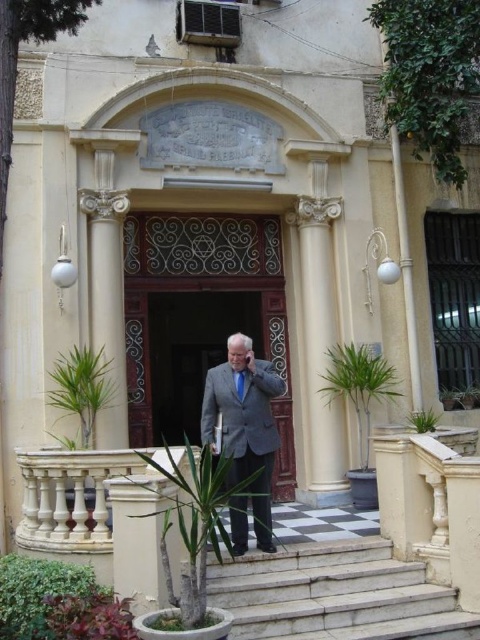
Question: Which point appears farthest from the camera in this image?

Choices:
 (A) (277, 234)
 (B) (347, 548)

Answer: (A)

Question: Can you confirm if white marble stairs at center is positioned to the left of blue silk tie at center?

Choices:
 (A) yes
 (B) no

Answer: (B)

Question: Which point is closer to the camera?

Choices:
 (A) light gray suit at center
 (B) wooden door at center

Answer: (A)

Question: Is wooden door at center positioned before white marble stairs at center?

Choices:
 (A) yes
 (B) no

Answer: (B)

Question: In this image, where is wooden door at center located relative to light gray suit at center?

Choices:
 (A) above
 (B) below

Answer: (A)

Question: Which point appears closest to the camera in this image?

Choices:
 (A) (233, 451)
 (B) (237, 636)

Answer: (B)